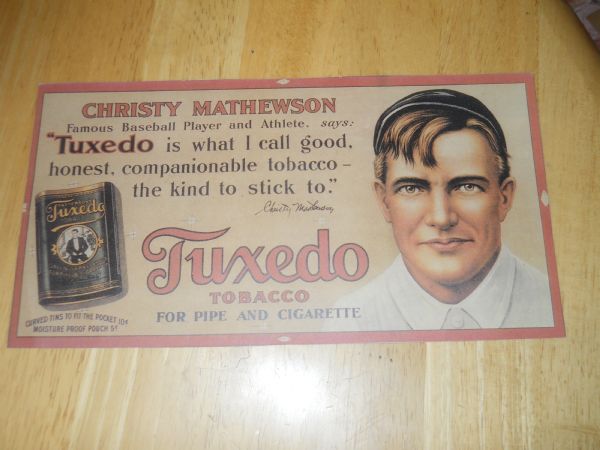
The image size is (600, 450). What are the coordinates of `surface` in the screenshot? It's located at (237, 55).